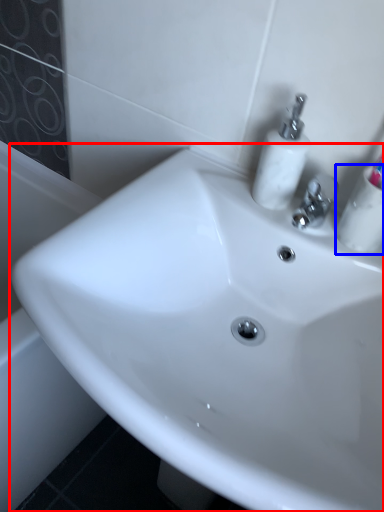
Question: Which point is further to the camera, sink (highlighted by a red box) or mouthwash (highlighted by a blue box)?

Choices:
 (A) sink
 (B) mouthwash

Answer: (B)